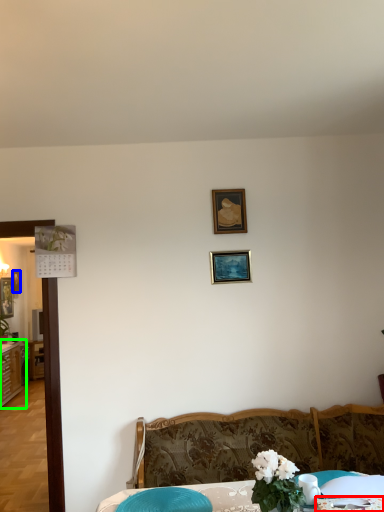
Question: Estimate the real-world distances between objects in this image. Which object is farther from tablecloth (highlighted by a red box), picture frame (highlighted by a blue box) or dresser (highlighted by a green box)?

Choices:
 (A) picture frame
 (B) dresser

Answer: (A)